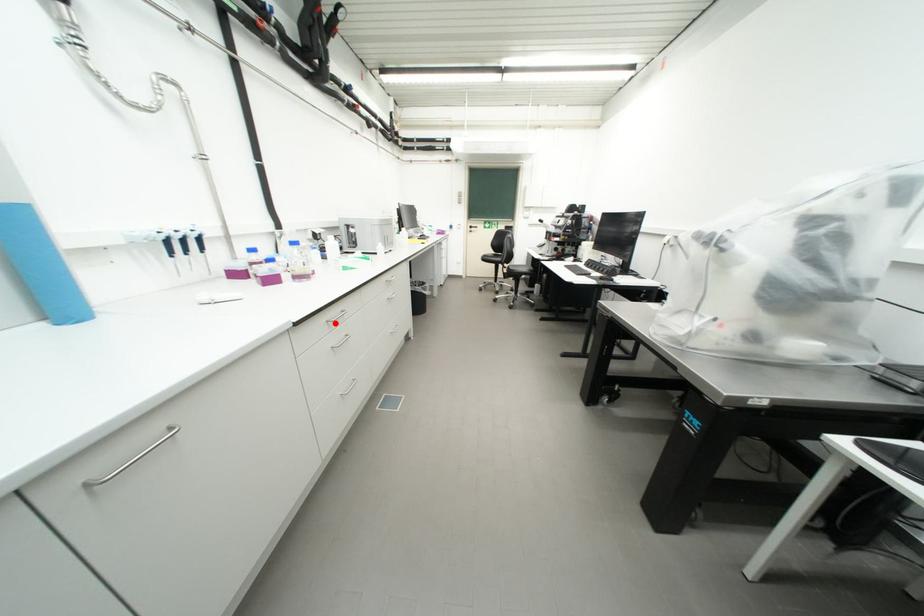
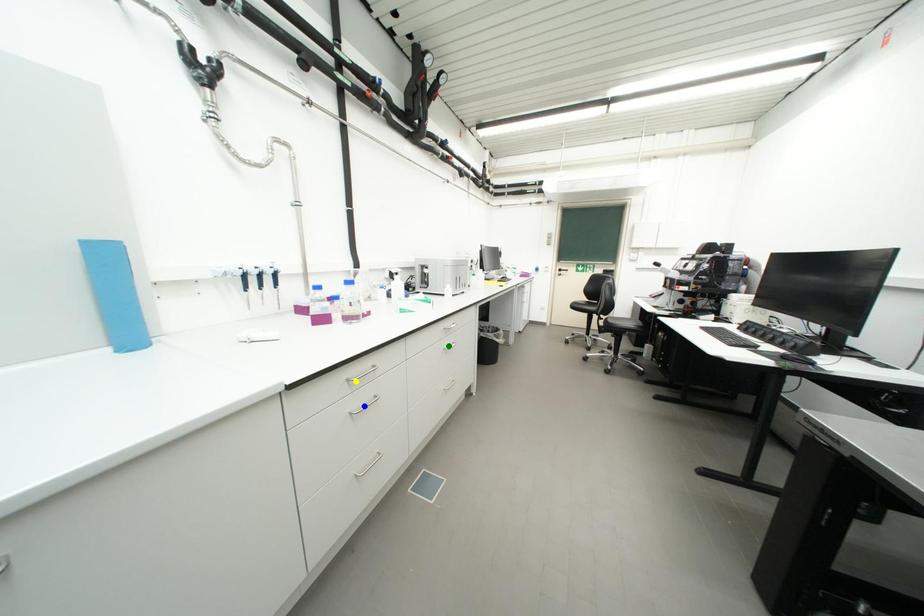
Question: I am providing you with two images of the same scene from different viewpoints. A red point is marked on the first image. You are given multiple points on the second image. Which spot in image 2 lines up with the point in image 1?

Choices:
 (A) green point
 (B) yellow point
 (C) blue point

Answer: (B)